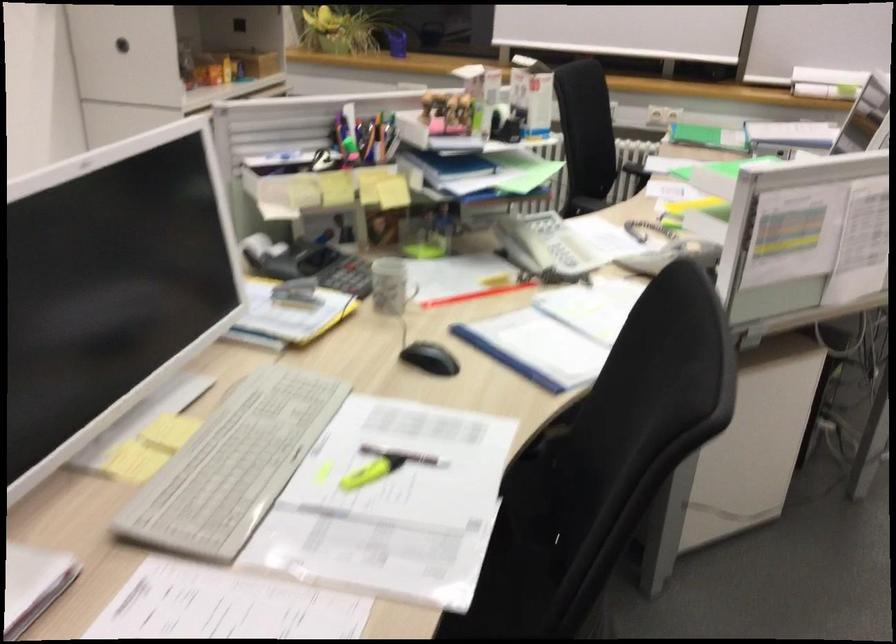
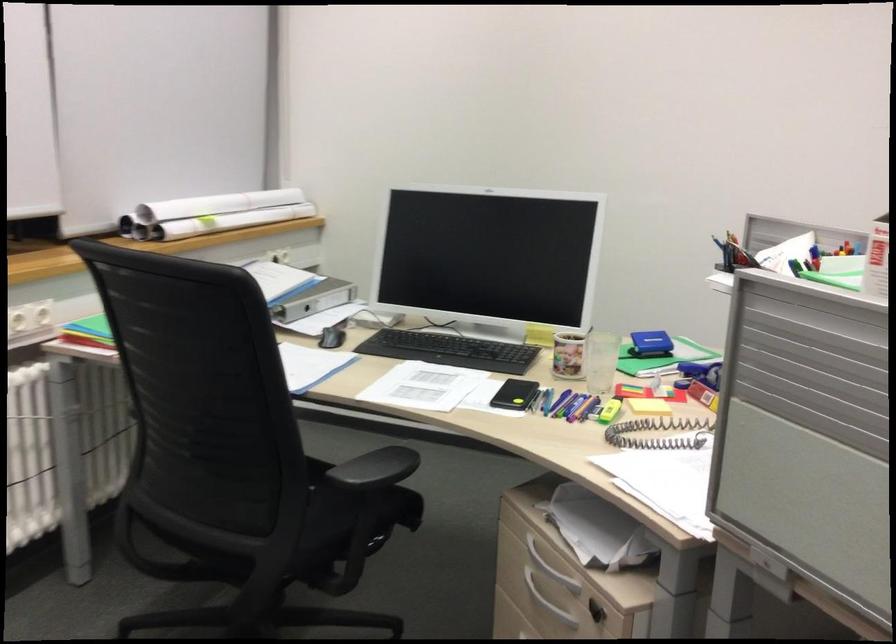
Locate, in the second image, the point that corresponds to the point at 787,144 in the first image.

(314, 299)